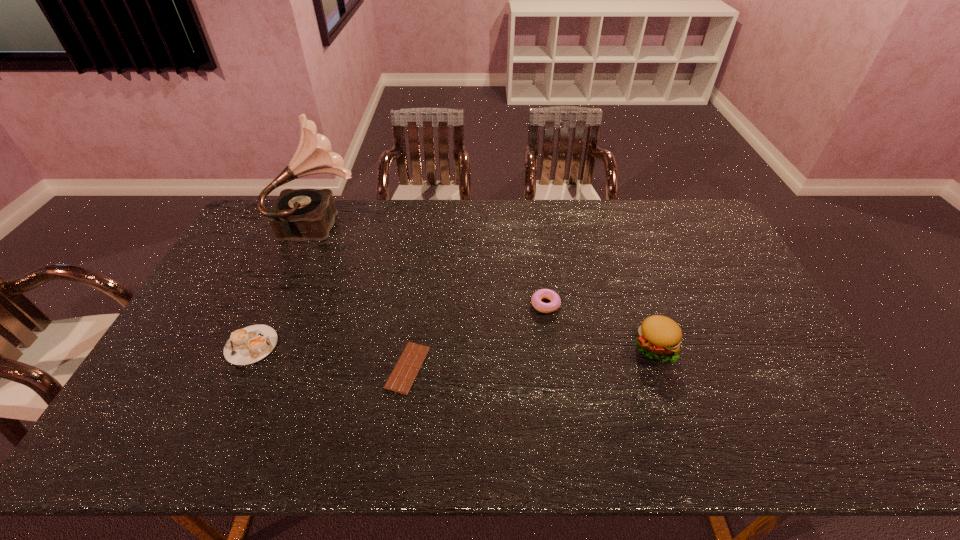
This screenshot has height=540, width=960. What are the coordinates of `free point that satisfies the following two spatial constraints: 1. from the horn of the rightmost object; 2. on the left side of the record player` in the screenshot? It's located at (270, 346).

At what (x,y) coordinates should I click in order to perform the action: click on vacant area that satisfies the following two spatial constraints: 1. from the horn of the record player; 2. on the right side of the hamburger. Please return your answer as a coordinate pair (x, y). Looking at the image, I should click on (270, 346).

In order to click on free space that satisfies the following two spatial constraints: 1. on the back side of the shortest object; 2. from the horn of the tallest object in this screenshot , I will do click(428, 222).